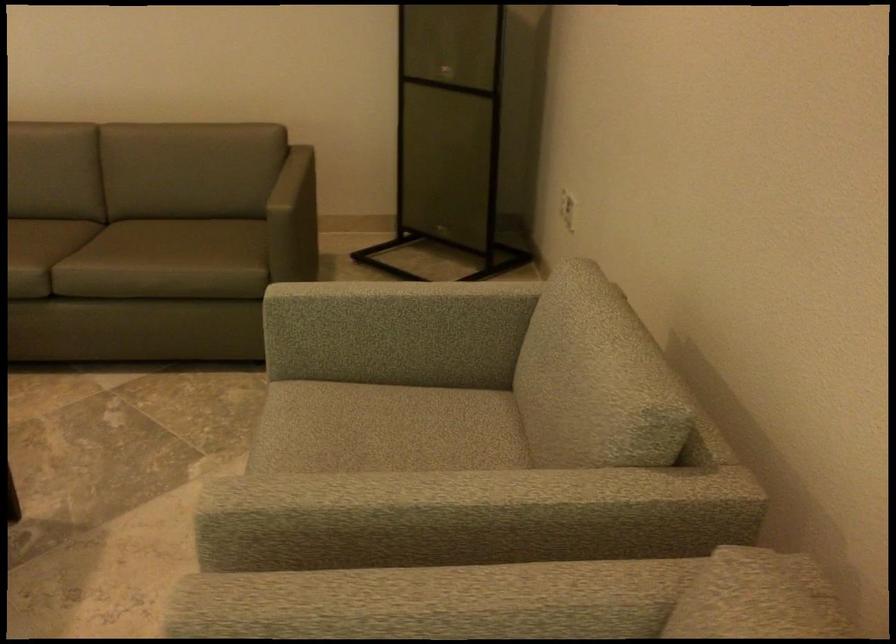
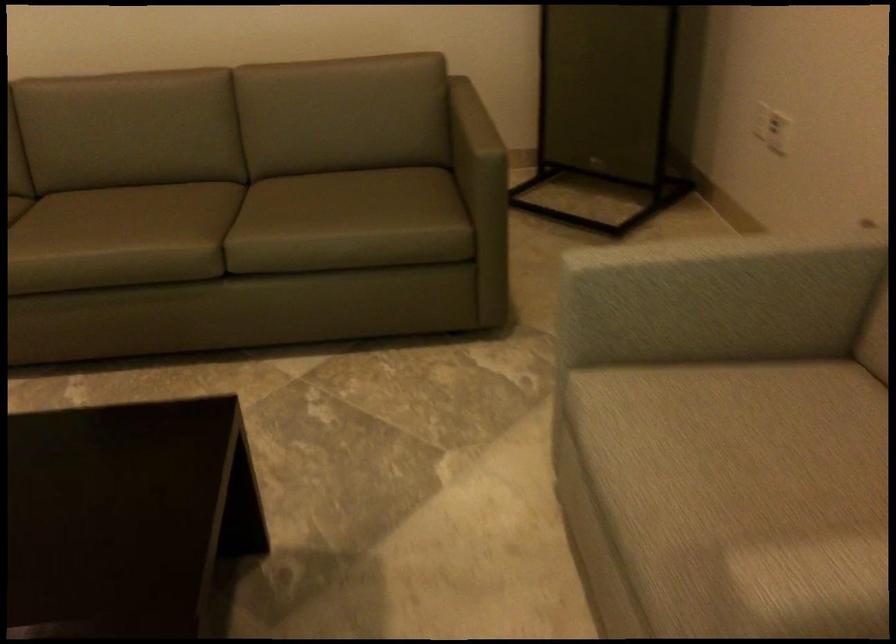
Question: How did the camera likely rotate?

Choices:
 (A) Left
 (B) Right
 (C) Up
 (D) Down

Answer: (D)